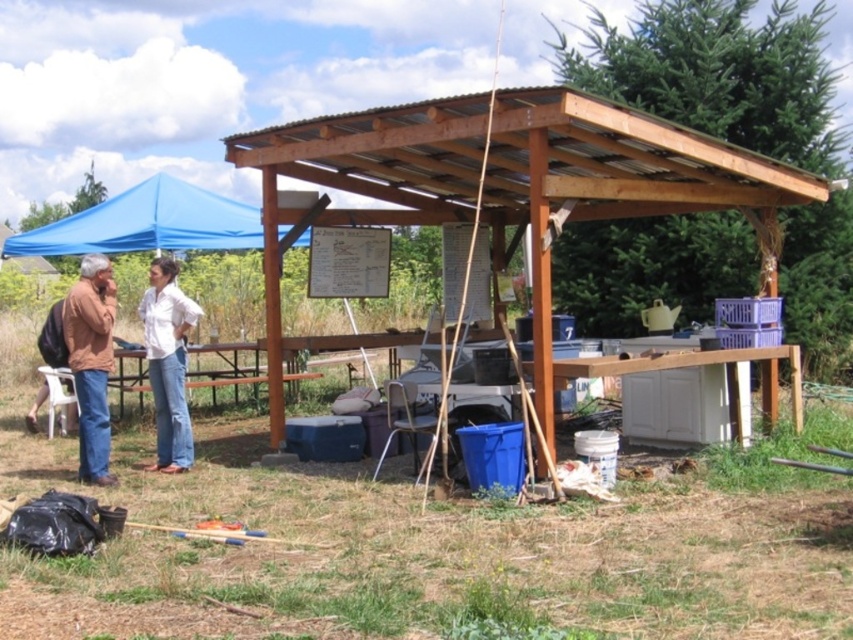
Question: Which is farther from the matte brown jacket at left?

Choices:
 (A) brown wooden pergola at center
 (B) brown leather jacket at left

Answer: (A)

Question: Estimate the real-world distances between objects in this image. Which object is closer to the white cotton shirt at center?

Choices:
 (A) brown leather jacket at left
 (B) blue fabric canopy at upper left

Answer: (A)

Question: Which of the following is the farthest from the observer?

Choices:
 (A) (28, 410)
 (B) (99, 356)
 (C) (171, 340)

Answer: (A)

Question: Is brown wooden pergola at center above matte brown jacket at left?

Choices:
 (A) no
 (B) yes

Answer: (B)

Question: Can you confirm if brown wooden pergola at center is positioned to the right of matte brown jacket at left?

Choices:
 (A) yes
 (B) no

Answer: (A)

Question: Does blue fabric canopy at upper left appear on the left side of white cotton shirt at center?

Choices:
 (A) no
 (B) yes

Answer: (B)